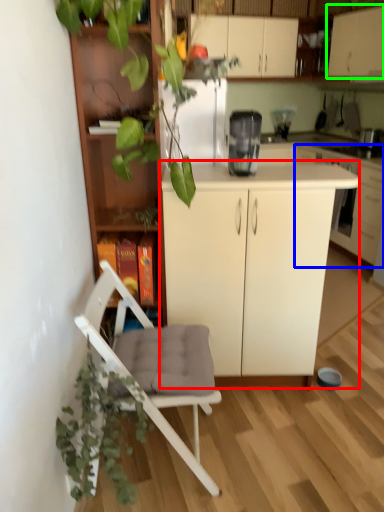
Question: Estimate the real-world distances between objects in this image. Which object is farther from cabinetry (highlighted by a red box), cabinetry (highlighted by a blue box) or cabinetry (highlighted by a green box)?

Choices:
 (A) cabinetry
 (B) cabinetry

Answer: (B)